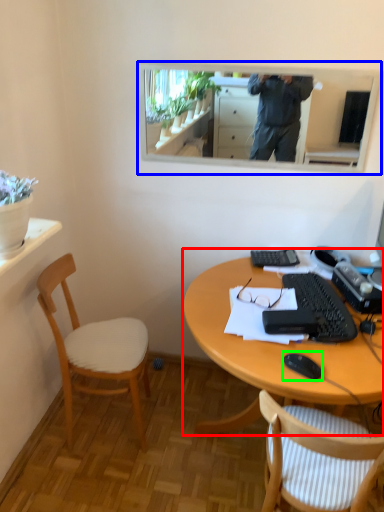
Question: Estimate the real-world distances between objects in this image. Which object is farther from desk (highlighted by a red box), mirror (highlighted by a blue box) or mouse (highlighted by a green box)?

Choices:
 (A) mirror
 (B) mouse

Answer: (A)